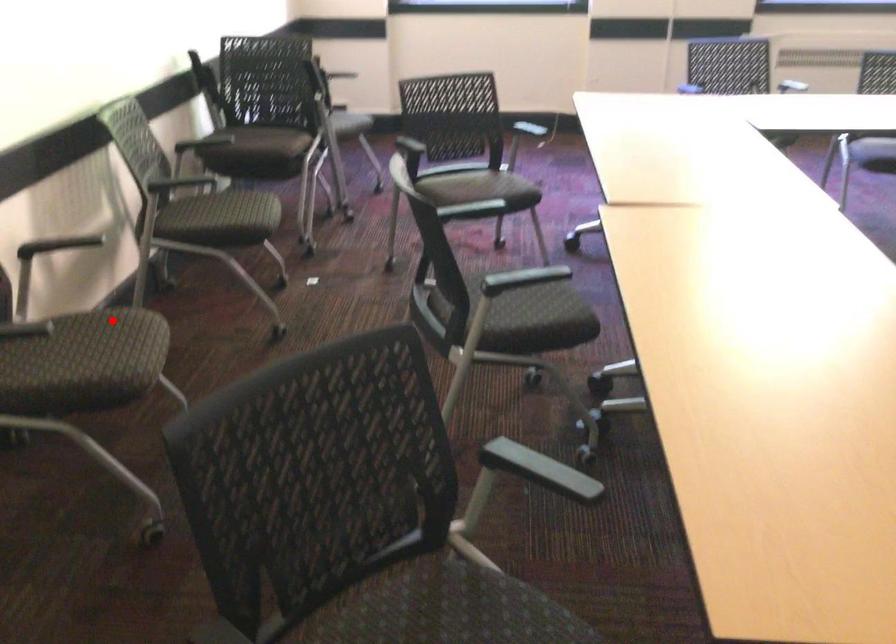
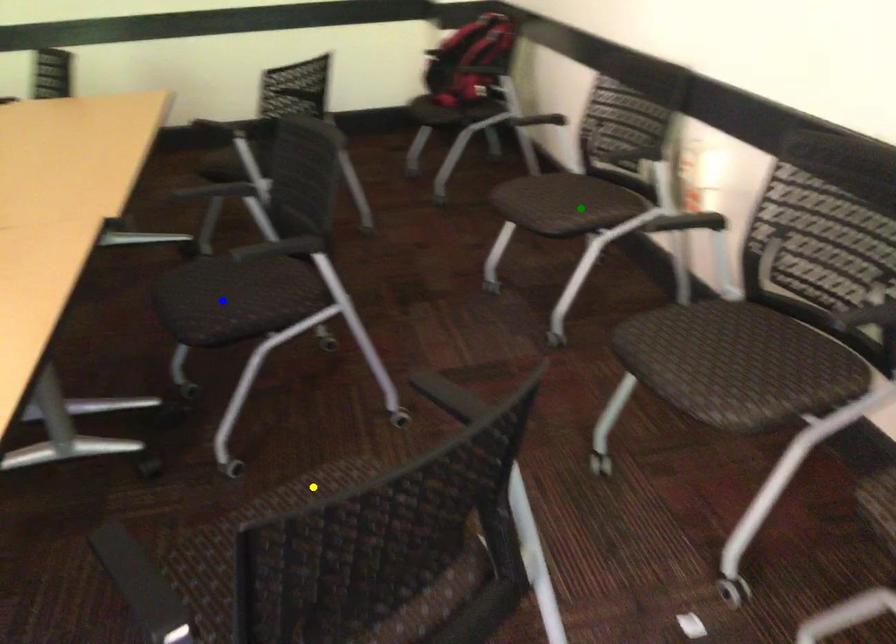
Question: I am providing you with two images of the same scene from different viewpoints. A red point is marked on the first image. You are given multiple points on the second image. Which point in image 2 represents the same 3d spot as the red point in image 1?

Choices:
 (A) blue point
 (B) yellow point
 (C) green point

Answer: (C)